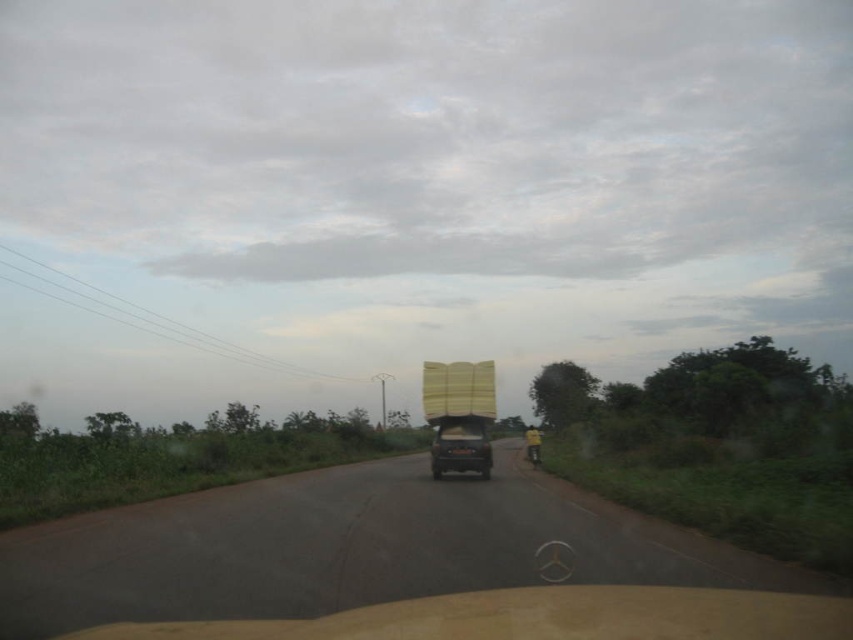
Can you confirm if asphalt road at center is positioned to the right of matte black truck at center?

In fact, asphalt road at center is to the left of matte black truck at center.

Does asphalt road at center appear on the left side of matte black truck at center?

Yes, asphalt road at center is to the left of matte black truck at center.

Who is more forward, (350, 579) or (474, 460)?

Positioned in front is point (350, 579).

This screenshot has width=853, height=640. I want to click on asphalt road at center, so click(x=349, y=548).

Can you confirm if asphalt road at center is shorter than wooden planks at center?

In fact, asphalt road at center may be taller than wooden planks at center.

Identify the location of asphalt road at center. (349, 548).

Can you confirm if wooden planks at center is bigger than matte black truck at center?

Yes, wooden planks at center is bigger than matte black truck at center.

Where is `wooden planks at center`? The image size is (853, 640). wooden planks at center is located at coordinates (459, 416).

This screenshot has width=853, height=640. In order to click on wooden planks at center in this screenshot , I will do `click(459, 416)`.